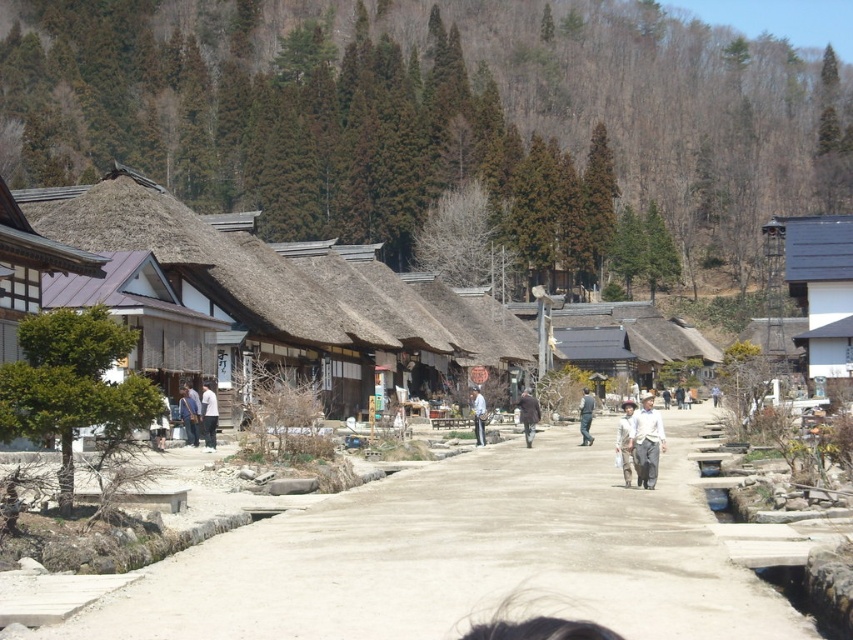
Question: Does light brown wooden pole at center appear on the left side of light blue denim pants at center?

Choices:
 (A) no
 (B) yes

Answer: (B)

Question: Which object is positioned closest to the light beige fabric pants at center?

Choices:
 (A) green grassy hillside at upper center
 (B) dirt road at center
 (C) dark brown leather jacket at center

Answer: (B)

Question: Which object is positioned farthest from the light blue denim pants at center?

Choices:
 (A) gray corrugated metal hut at right
 (B) dirt road at center

Answer: (A)

Question: Considering the relative positions of light beige fabric pants at center and light blue denim pants at center in the image provided, where is light beige fabric pants at center located with respect to light blue denim pants at center?

Choices:
 (A) above
 (B) below

Answer: (B)

Question: In this image, where is light brown leather jacket at center located relative to light blue denim pants at center?

Choices:
 (A) below
 (B) above

Answer: (A)

Question: Which object is positioned farthest from the dirt road at center?

Choices:
 (A) blue denim jeans at center
 (B) white cotton shirt at center

Answer: (B)